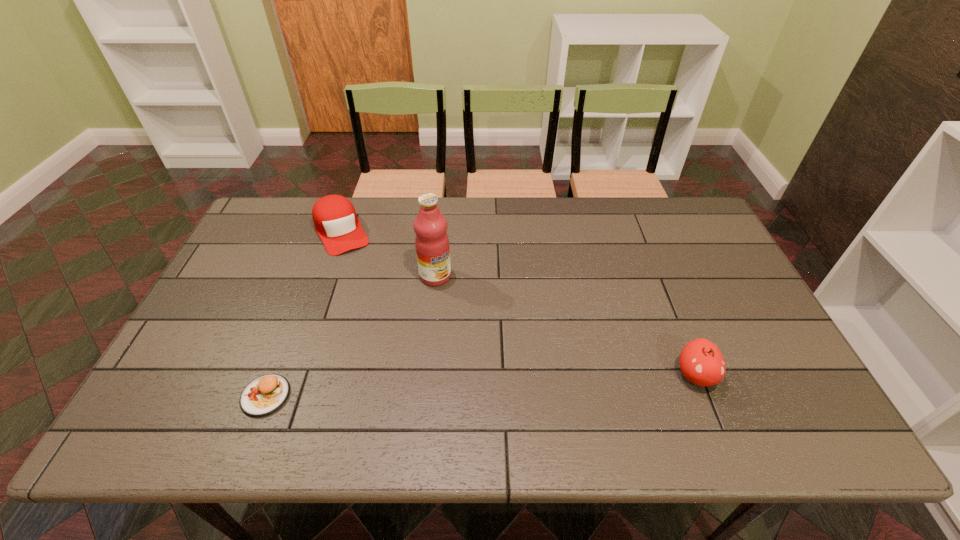
You are a GUI agent. You are given a task and a screenshot of the screen. Output one action in this format:
    pyautogui.click(x=<x>, y=<y>)
    Task: Click on the vacant space on the desktop that is between the patty and the apple and is positioned on the label of the third object from left to right
    The height and width of the screenshot is (540, 960).
    Given the screenshot: What is the action you would take?
    pyautogui.click(x=516, y=384)

Locate an element on the screen. vacant spot on the desktop that is between the shortest object and the apple and is positioned on the front-facing side of the farthest object is located at coordinates (421, 388).